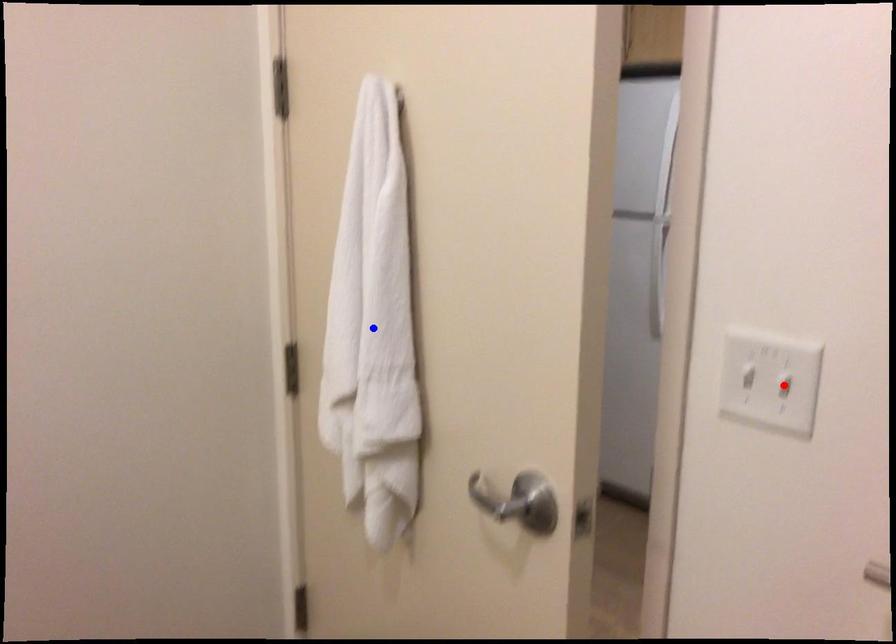
Question: Which of the two points in the image is closer to the camera?

Choices:
 (A) Blue point is closer.
 (B) Red point is closer.

Answer: (B)